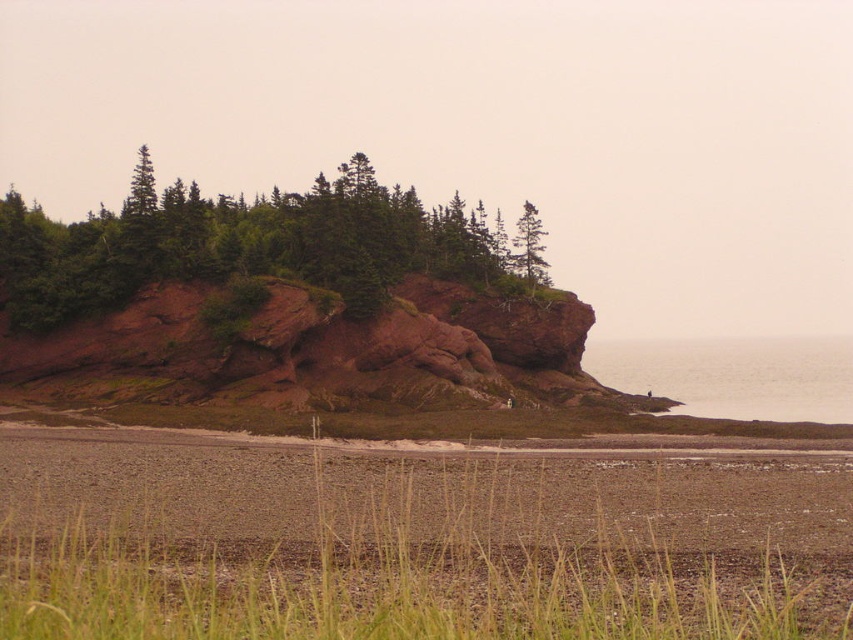
Is point (457, 221) positioned before point (722, 396)?

That is True.

Between green matte rock at center and clear water at lower right, which one appears on the left side from the viewer's perspective?

green matte rock at center

Is point (483, 241) positioned behind point (691, 371)?

No.

The width and height of the screenshot is (853, 640). I want to click on green matte rock at center, so click(242, 243).

Does clear water at lower right appear on the right side of green matte tree at upper center?

Indeed, clear water at lower right is positioned on the right side of green matte tree at upper center.

Is point (598, 371) closer to viewer compared to point (521, 276)?

No, it is not.

Find the location of a particular element. The image size is (853, 640). clear water at lower right is located at coordinates (734, 376).

Locate an element on the screen. Image resolution: width=853 pixels, height=640 pixels. clear water at lower right is located at coordinates (734, 376).

Which is in front, point (64, 554) or point (527, 228)?

Point (64, 554)

Can you confirm if brown gravel beach at lower center is smaller than green matte tree at upper center?

Actually, brown gravel beach at lower center might be larger than green matte tree at upper center.

Locate an element on the screen. The width and height of the screenshot is (853, 640). brown gravel beach at lower center is located at coordinates (415, 540).

Locate an element on the screen. This screenshot has height=640, width=853. brown gravel beach at lower center is located at coordinates (415, 540).